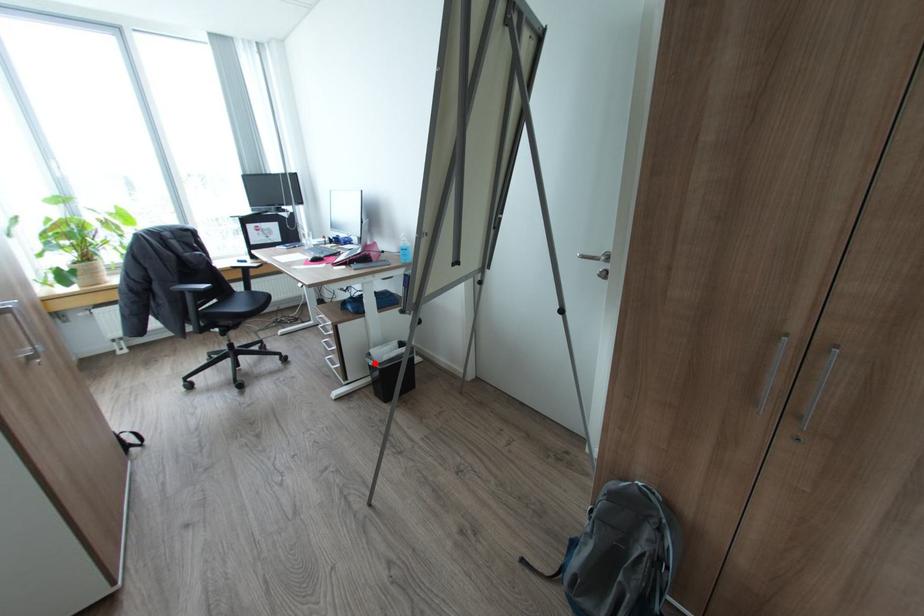
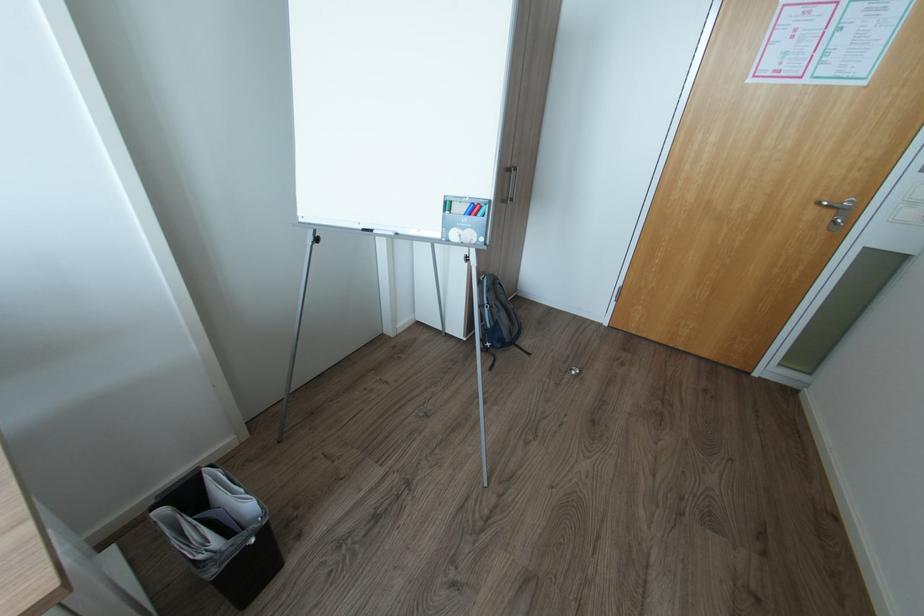
Where in the second image is the point corresponding to the highlighted location from the first image?

(257, 541)